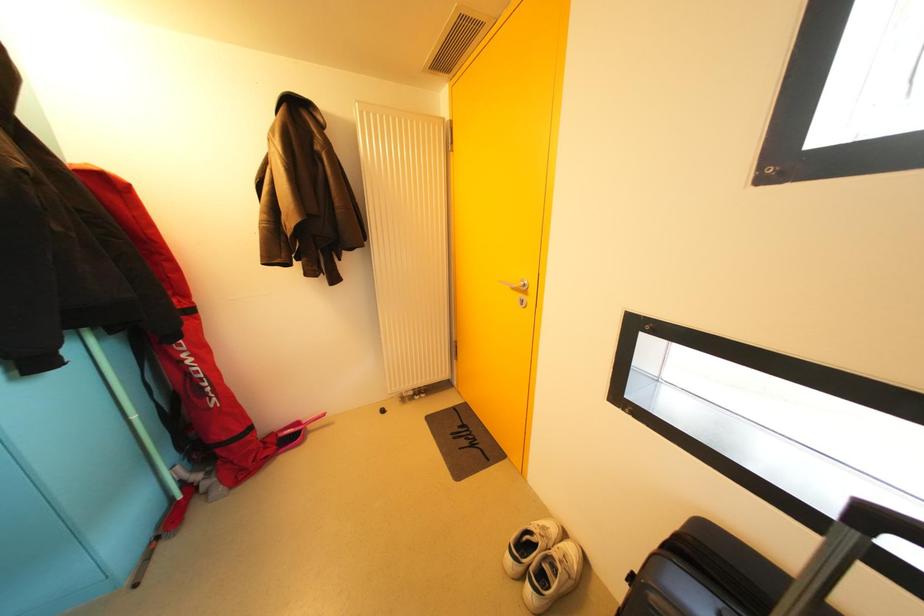
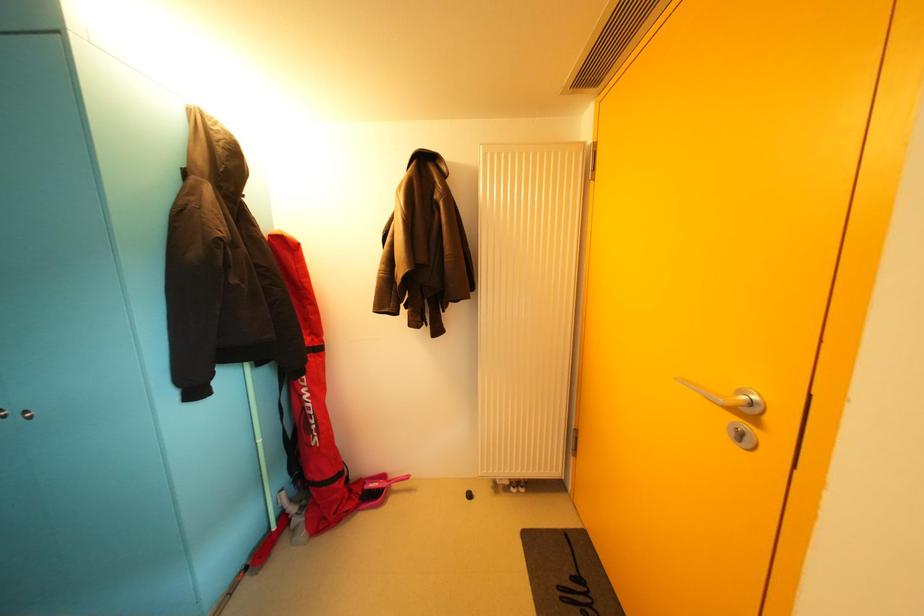
Question: The camera is either moving clockwise (left) or counter-clockwise (right) around the object. The first image is from the beginning of the video and the second image is from the end. Is the camera moving left or right when shooting the video?

Choices:
 (A) Left
 (B) Right

Answer: (B)